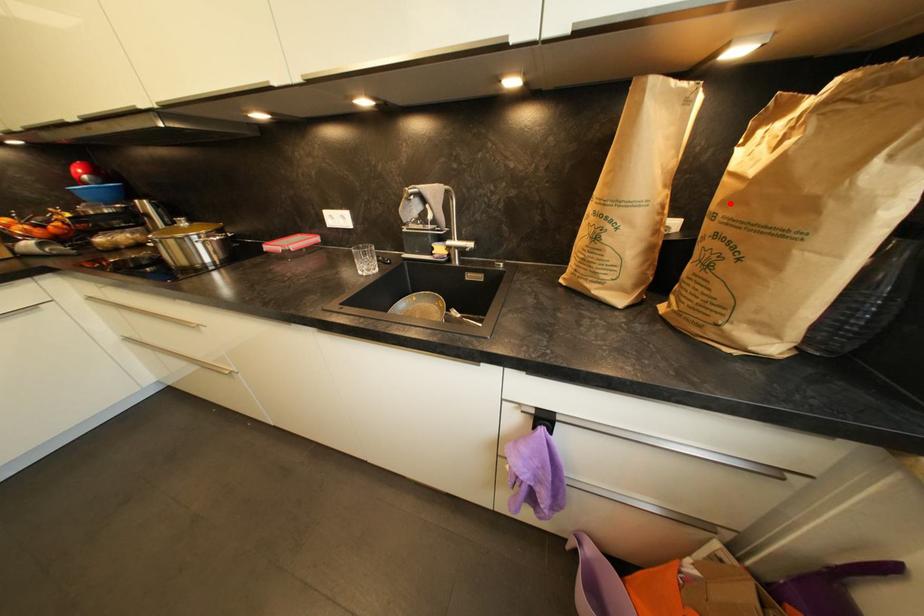
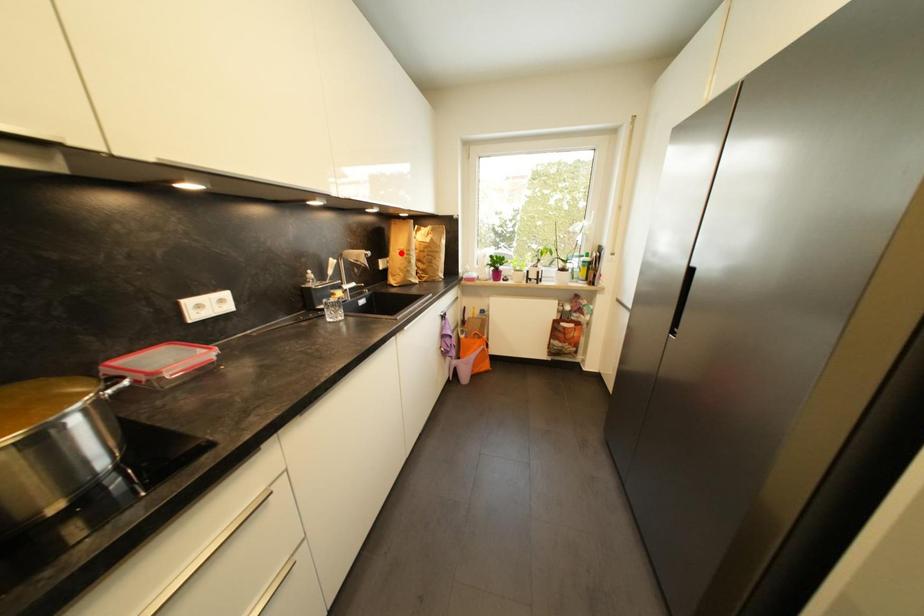
I am providing you with two images of the same scene from different viewpoints. A red point is marked on the first image and another point is marked on the second image. Do the highlighted points in image1 and image2 indicate the same real-world spot?

No